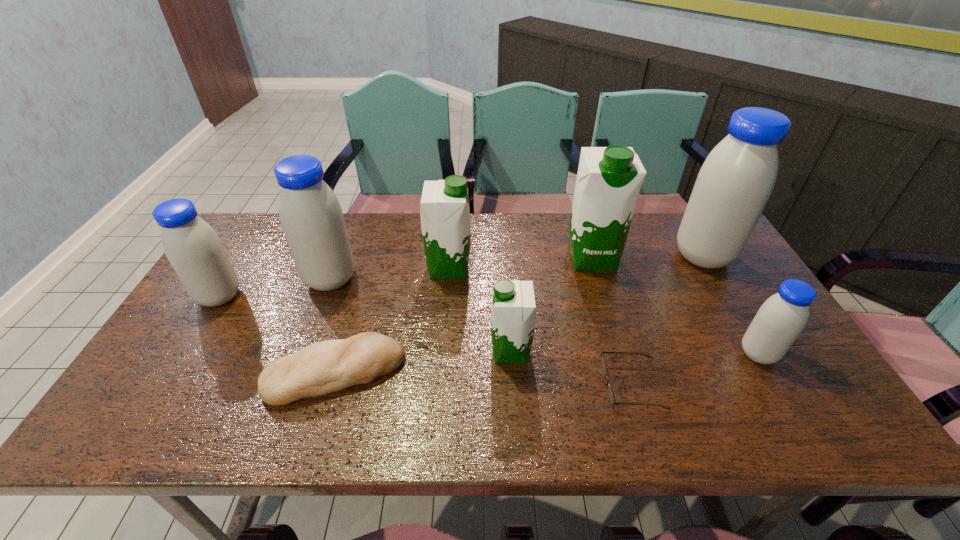
The width and height of the screenshot is (960, 540). In order to click on free location located on the back of the leftmost soya milk in this screenshot , I will do `click(244, 258)`.

Identify the location of free space located on the front-facing side of the nearest green soya milk. The height and width of the screenshot is (540, 960). (343, 352).

The width and height of the screenshot is (960, 540). Identify the location of vacant area located on the front-facing side of the nearest green soya milk. (455, 352).

Locate an element on the screen. vacant region located 0.140m on the front-facing side of the nearest green soya milk is located at coordinates (435, 352).

Identify the location of vacant space located 0.370m on the back of the smallest blue soya milk. The image size is (960, 540). (697, 250).

Identify the location of free space located on the right of the brown bread. (537, 373).

Where is `vacant space located 0.240m on the front-facing side of the shortest object`? vacant space located 0.240m on the front-facing side of the shortest object is located at coordinates (503, 383).

Identify the location of free space located on the front-facing side of the shortest object. tap(528, 383).

Image resolution: width=960 pixels, height=540 pixels. I want to click on vacant space located 0.330m on the front-facing side of the shortest object, so click(465, 383).

Locate an element on the screen. This screenshot has width=960, height=540. bread positioned at the near edge is located at coordinates (321, 368).